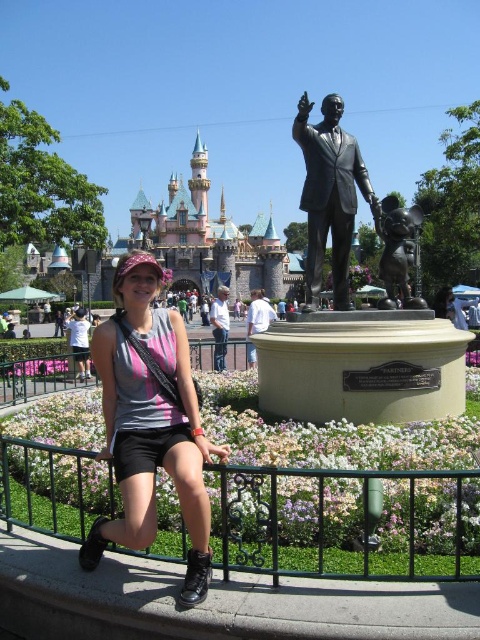
You are a visitor at Disneyland and you see the pink stone castle at upper center and the pink fabric shirt at center. Which object is closer to you?

The pink fabric shirt at center is behind the pink stone castle at upper center, so the pink stone castle at upper center is closer to you.

You are standing in the Disneyland scene described. You need to place a new decorative element exactly at the coordinates specified for the matte gray tank top at center. What are the coordinates where you should place it?

The coordinates for the matte gray tank top at center are at point (151, 422).

You are a photographer at Disneyland and want to capture both the matte gray tank top at center and the bronze mickey mouse statue at center in a single photo. Since you want the tank top to be visible, should you adjust your camera angle to look upwards or downwards?

The matte gray tank top at center is located below the bronze mickey mouse statue at center, so you should adjust your camera angle to look downwards to ensure the tank top is visible.